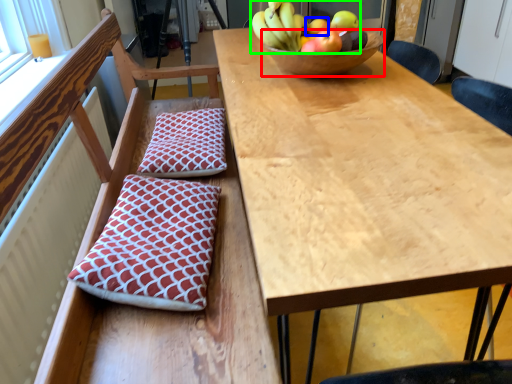
Question: Which object is the farthest from bowl (highlighted by a red box)? Choose among these: apple (highlighted by a blue box) or banana (highlighted by a green box).

Choices:
 (A) apple
 (B) banana

Answer: (A)